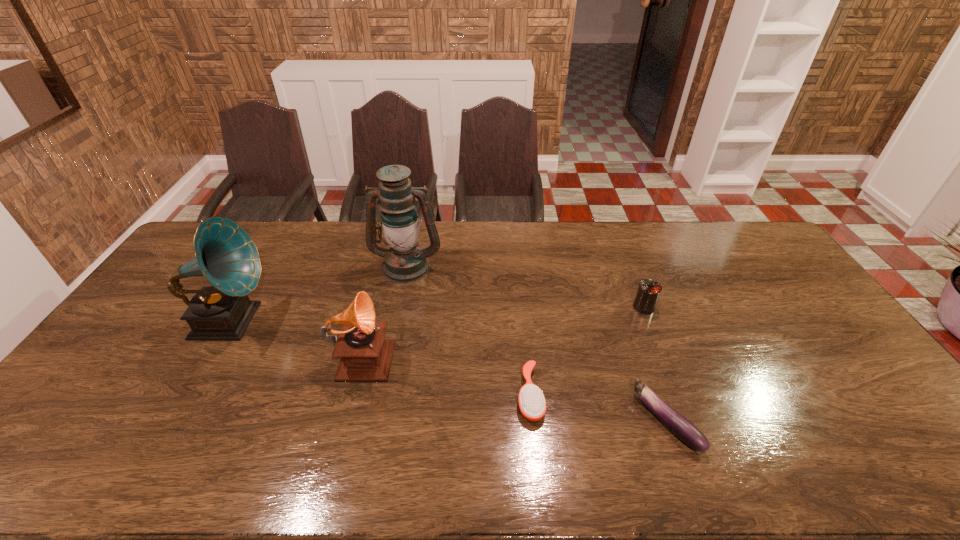
The height and width of the screenshot is (540, 960). What are the coordinates of `vacant space located 0.300m on the horn of the third tallest object` in the screenshot? It's located at (498, 353).

Find the location of a particular element. This screenshot has width=960, height=540. vacant area located 0.330m on the left of the can is located at coordinates (529, 307).

The image size is (960, 540). In order to click on vacant space located on the back of the eggplant in this screenshot , I will do `click(636, 334)`.

At what (x,y) coordinates should I click in order to perform the action: click on free point located on the right of the fourth object from left to right. Please return your answer as a coordinate pair (x, y). The width and height of the screenshot is (960, 540). Looking at the image, I should click on (582, 395).

Image resolution: width=960 pixels, height=540 pixels. In order to click on object present at the far edge in this screenshot , I will do `click(405, 261)`.

Image resolution: width=960 pixels, height=540 pixels. Find the location of `object that is at the near edge`. object that is at the near edge is located at coordinates (681, 427).

The height and width of the screenshot is (540, 960). What are the coordinates of `vacant area at the far edge of the desktop` in the screenshot? It's located at (348, 248).

This screenshot has width=960, height=540. I want to click on vacant space at the left edge, so click(x=61, y=417).

I want to click on blank space at the right edge, so click(866, 381).

The width and height of the screenshot is (960, 540). I want to click on free location at the near left corner of the desktop, so click(81, 462).